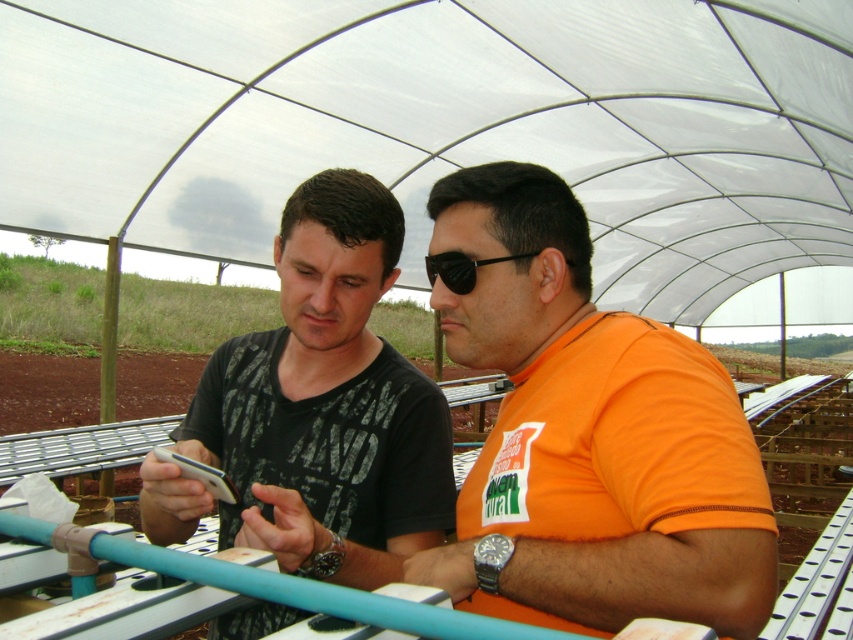
Question: Which object is positioned farthest from the black matte shirt at center?

Choices:
 (A) black plastic goggles at center
 (B) orange cotton shirt at center

Answer: (A)

Question: Estimate the real-world distances between objects in this image. Which object is closer to the orange cotton shirt at center?

Choices:
 (A) black matte shirt at center
 (B) black plastic goggles at center

Answer: (B)

Question: Is black matte shirt at center to the left of black plastic goggles at center from the viewer's perspective?

Choices:
 (A) yes
 (B) no

Answer: (A)

Question: Which of the following is the farthest from the observer?

Choices:
 (A) black matte shirt at center
 (B) black plastic goggles at center
 (C) orange cotton shirt at center

Answer: (B)

Question: Does orange cotton shirt at center appear on the right side of black matte shirt at center?

Choices:
 (A) yes
 (B) no

Answer: (A)

Question: Is orange cotton shirt at center smaller than black matte shirt at center?

Choices:
 (A) no
 (B) yes

Answer: (B)